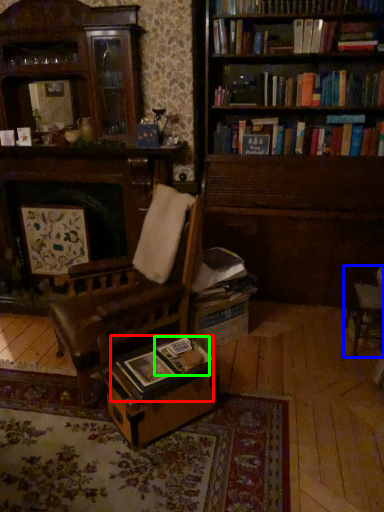
Question: Which is farther away from book (highlighted by a red box)? chair (highlighted by a blue box) or paperback book (highlighted by a green box)?

Choices:
 (A) chair
 (B) paperback book

Answer: (A)